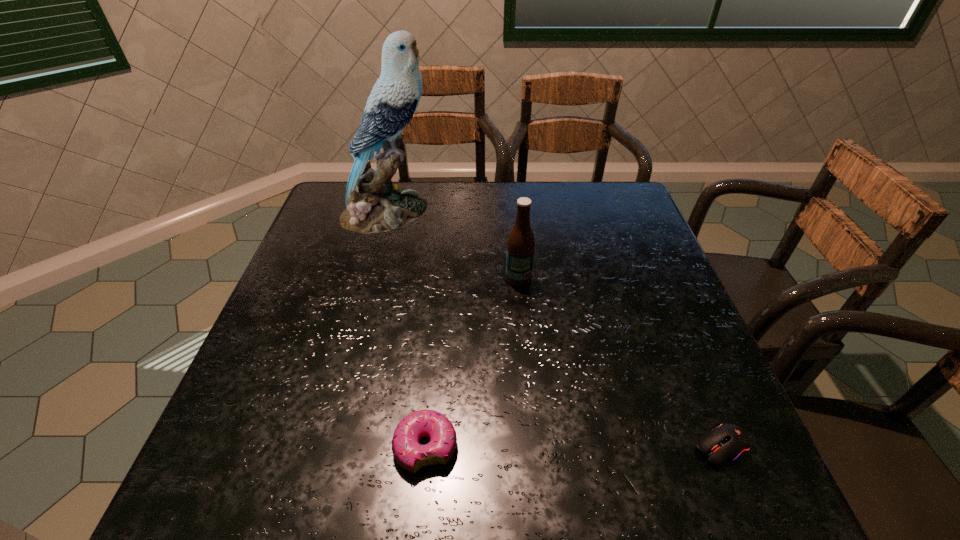
Image resolution: width=960 pixels, height=540 pixels. Find the location of `vacant space situated 0.140m on the back of the rightmost object`. vacant space situated 0.140m on the back of the rightmost object is located at coordinates (687, 364).

Locate an element on the screen. The image size is (960, 540). object present at the far edge is located at coordinates (373, 205).

Locate an element on the screen. This screenshot has height=540, width=960. doughnut at the near edge is located at coordinates (412, 456).

Find the location of a particular element. This screenshot has height=540, width=960. computer mouse present at the near edge is located at coordinates (726, 443).

The width and height of the screenshot is (960, 540). What are the coordinates of `object that is at the left edge` in the screenshot? It's located at (373, 205).

The width and height of the screenshot is (960, 540). I want to click on object that is positioned at the right edge, so click(726, 443).

Identify the location of object that is at the far left corner. The width and height of the screenshot is (960, 540). (373, 205).

Where is `object that is at the near right corner`? object that is at the near right corner is located at coordinates (726, 443).

At what (x,y) coordinates should I click in order to perform the action: click on free space at the far edge. Please return your answer as a coordinate pair (x, y). This screenshot has width=960, height=540. Looking at the image, I should click on (463, 202).

Image resolution: width=960 pixels, height=540 pixels. What are the coordinates of `vacant area at the near edge of the desktop` in the screenshot? It's located at (661, 476).